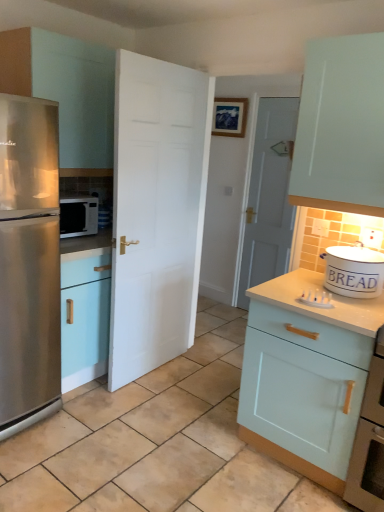
Question: Looking at the image, does stainless steel refrigerator at left seem bigger or smaller compared to light blue wood cabinet at right, the first cabinetry from the bottom?

Choices:
 (A) small
 (B) big

Answer: (B)

Question: Would you say stainless steel refrigerator at left is to the left or to the right of light blue wood cabinet at right, the second cabinetry positioned from the left, in the picture?

Choices:
 (A) right
 (B) left

Answer: (B)

Question: Based on their relative distances, which object is nearer to the white wooden door at center, the 1th door in the back-to-front sequence?

Choices:
 (A) satin silver microwave at left
 (B) matte white cabinet at left, the 1th cabinetry in the left-to-right sequence
 (C) light blue wood cabinet at right, which is counted as the first cabinetry, starting from the right
 (D) stainless steel refrigerator at left
 (E) white matte door at center, positioned as the 1th door in left-to-right order

Answer: (E)

Question: Estimate the real-world distances between objects in this image. Which object is farther from the white ceramic bread bin at right?

Choices:
 (A) light blue wood cabinet at right, the first cabinetry from the bottom
 (B) white wooden door at center, the 1th door in the back-to-front sequence
 (C) white matte door at center, positioned as the 1th door in left-to-right order
 (D) satin silver microwave at left
 (E) stainless steel refrigerator at left

Answer: (B)